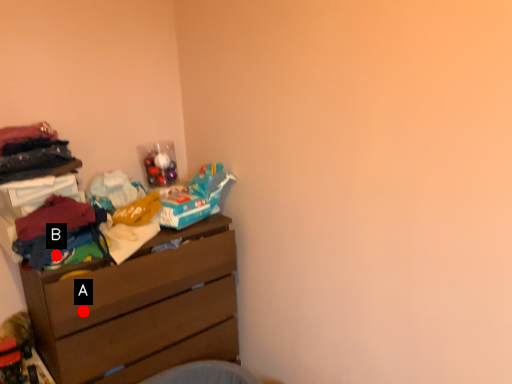
Question: Two points are circled on the image, labeled by A and B beside each circle. Which point appears closest to the camera in this image?

Choices:
 (A) A is closer
 (B) B is closer

Answer: (B)